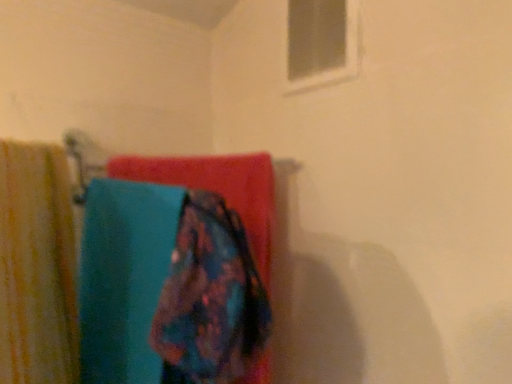
Question: Is white plastic window at upper center to the right of floral fabric towel at center from the viewer's perspective?

Choices:
 (A) yes
 (B) no

Answer: (A)

Question: Does white plastic window at upper center appear on the left side of floral fabric towel at center?

Choices:
 (A) no
 (B) yes

Answer: (A)

Question: Is the surface of white plastic window at upper center in direct contact with floral fabric towel at center?

Choices:
 (A) yes
 (B) no

Answer: (B)

Question: Is white plastic window at upper center oriented away from floral fabric towel at center?

Choices:
 (A) yes
 (B) no

Answer: (B)

Question: Considering the relative sizes of white plastic window at upper center and floral fabric towel at center in the image provided, is white plastic window at upper center taller than floral fabric towel at center?

Choices:
 (A) no
 (B) yes

Answer: (B)

Question: From the image's perspective, does white plastic window at upper center appear lower than floral fabric towel at center?

Choices:
 (A) no
 (B) yes

Answer: (A)

Question: Is floral fabric towel at center behind yellow striped fabric at left?

Choices:
 (A) yes
 (B) no

Answer: (A)

Question: From a real-world perspective, is floral fabric towel at center beneath yellow striped fabric at left?

Choices:
 (A) yes
 (B) no

Answer: (B)

Question: Is floral fabric towel at center smaller than yellow striped fabric at left?

Choices:
 (A) yes
 (B) no

Answer: (A)

Question: Can you see floral fabric towel at center touching yellow striped fabric at left?

Choices:
 (A) yes
 (B) no

Answer: (B)

Question: Considering the relative sizes of floral fabric towel at center and yellow striped fabric at left in the image provided, is floral fabric towel at center thinner than yellow striped fabric at left?

Choices:
 (A) yes
 (B) no

Answer: (A)

Question: Is floral fabric towel at center looking in the opposite direction of yellow striped fabric at left?

Choices:
 (A) yes
 (B) no

Answer: (A)

Question: Is white plastic window at upper center surrounded by floral fabric towel at center?

Choices:
 (A) yes
 (B) no

Answer: (B)